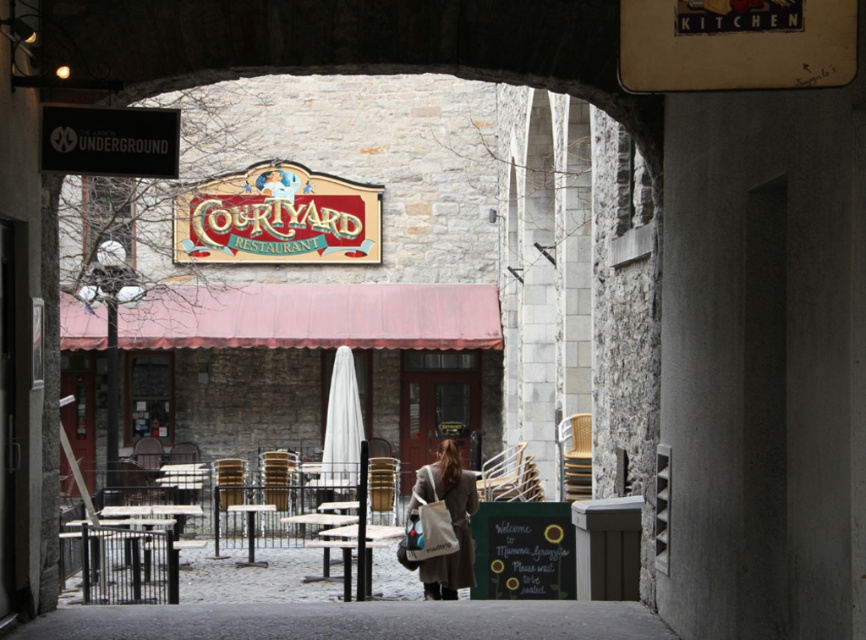
You are standing in front of the arched stone doorway leading to the courtyard restaurant. You want to reach a point that is 32.12 meters away from your current position. Is the point at coordinates point [341,460] within the courtyard area?

The point at coordinates point [341,460] is 32.12 meters away from the viewer, so yes, it is within the courtyard area since the distance matches the required 32.12 meters.

You are standing in front of the arched stone doorway of the restaurant. You notice two points marked on the ground. The first point is at coordinate point (423, 584) and the second is at point (373, 536). If you were to walk towards the courtyard, which point would you encounter first?

Point (423, 584) is in front of point (373, 536), so you would encounter point (423, 584) first as you walk towards the courtyard.

You are standing in front of the arched stone doorway of the restaurant. There are two points marked on the doorway. Which point is closer to you, point (331, 420) or point (251, 552)?

Point (331, 420) is closer to you because it is further to the viewer than point (251, 552).